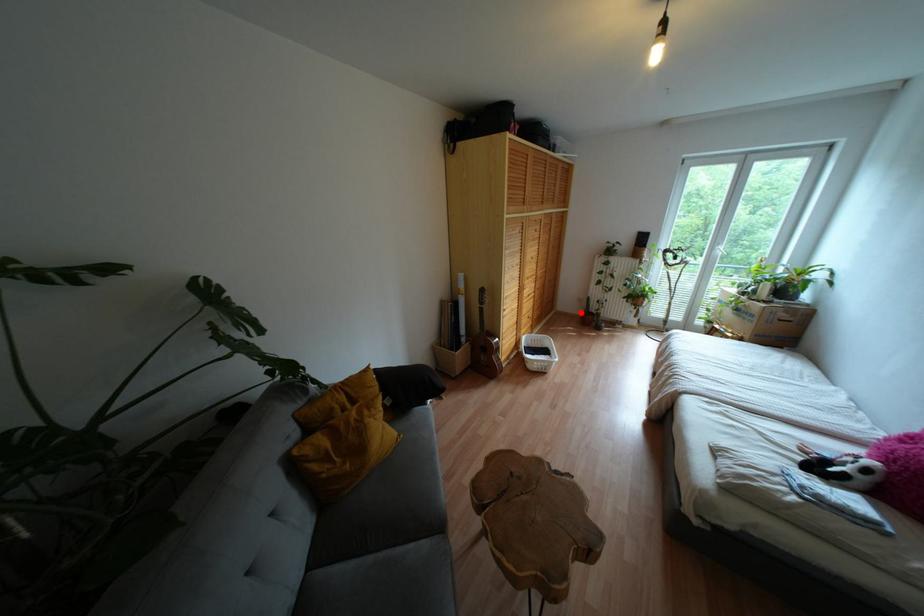
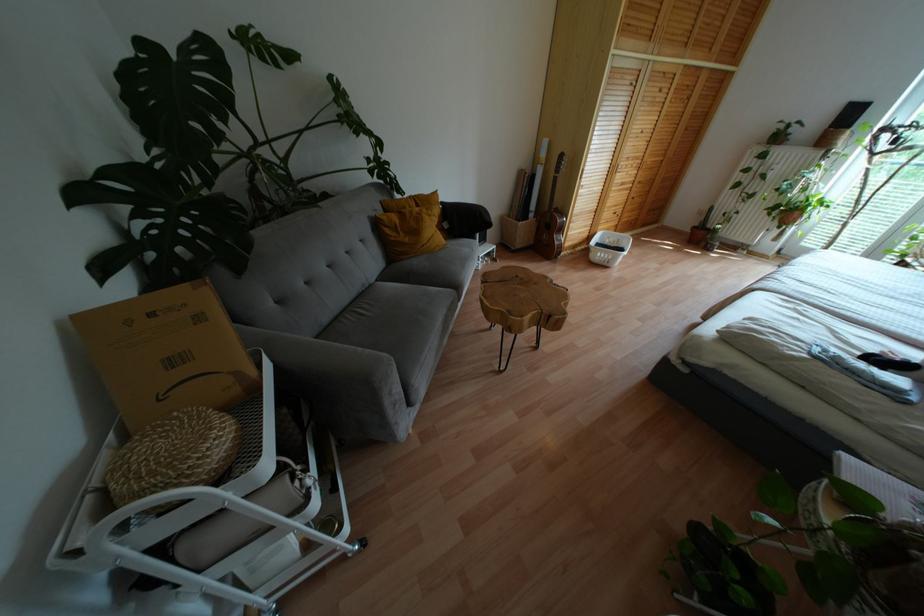
Find the pixel in the second image that matches the highlighted location in the first image.

(694, 227)